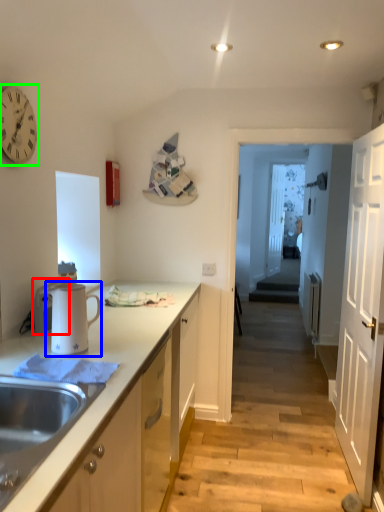
Question: Which is nearer to the appliance (highlighted by a red box)? appliance (highlighted by a blue box) or clock (highlighted by a green box).

Choices:
 (A) appliance
 (B) clock

Answer: (A)